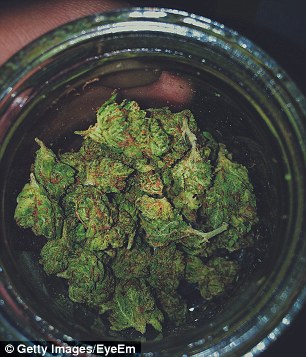
I want to click on bowl, so click(126, 70), click(263, 184), click(189, 318), click(20, 240).